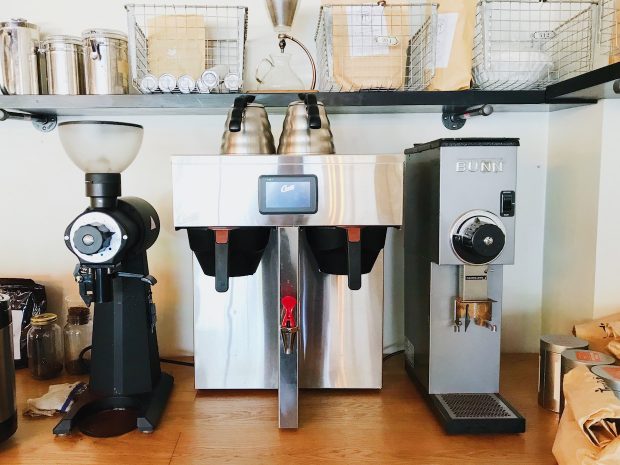
This screenshot has width=620, height=465. Find the location of `coffee filter basket`. coffee filter basket is located at coordinates (255, 245), (330, 240).